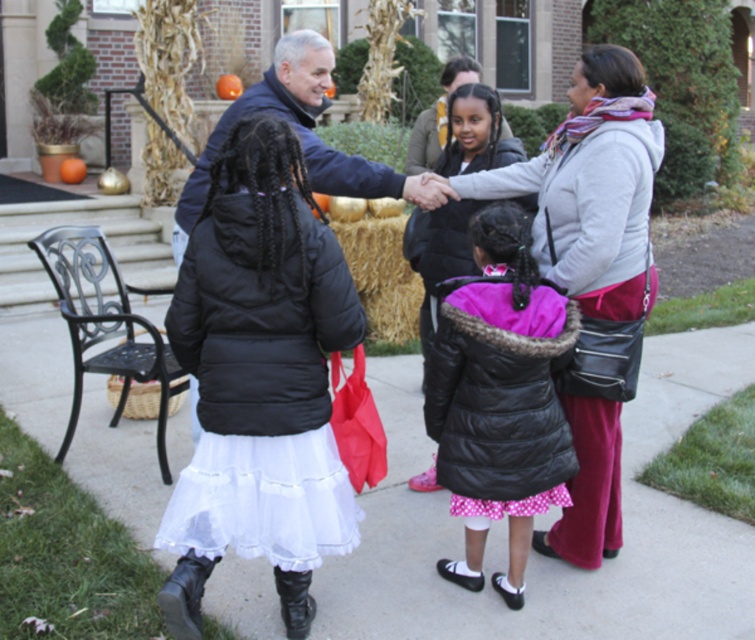
Question: Does black matte jacket at center have a greater width compared to matte black jacket at center?

Choices:
 (A) yes
 (B) no

Answer: (B)

Question: Which point is closer to the camera taking this photo?

Choices:
 (A) (341, 180)
 (B) (461, 452)
 (C) (575, 74)

Answer: (B)

Question: Which object is closer to the camera taking this photo?

Choices:
 (A) black matte jacket at center
 (B) blue smooth jacket at center
 (C) matte gray hoodie at center

Answer: (A)

Question: Considering the real-world distances, which object is farthest from the matte gray hoodie at center?

Choices:
 (A) white matte pavement at lower center
 (B) blue smooth jacket at center
 (C) haybrown at center

Answer: (C)

Question: Does black matte jacket at center appear on the left side of matte gray hoodie at center?

Choices:
 (A) no
 (B) yes

Answer: (B)

Question: Considering the relative positions of matte black jacket at center and matte gray hoodie at center in the image provided, where is matte black jacket at center located with respect to matte gray hoodie at center?

Choices:
 (A) below
 (B) above

Answer: (A)